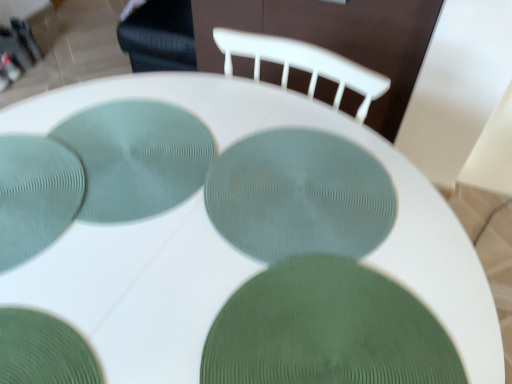
You are a GUI agent. You are given a task and a screenshot of the screen. Output one action in this format:
    pyautogui.click(x=<x>, y=<y>)
    Task: Click on the free space underneath teal textured placemat at center, which ranks as the third glass plate in right-to-left order (from a real-world perspective)
    Image resolution: width=512 pixels, height=384 pixels.
    Given the screenshot: What is the action you would take?
    pyautogui.click(x=101, y=157)